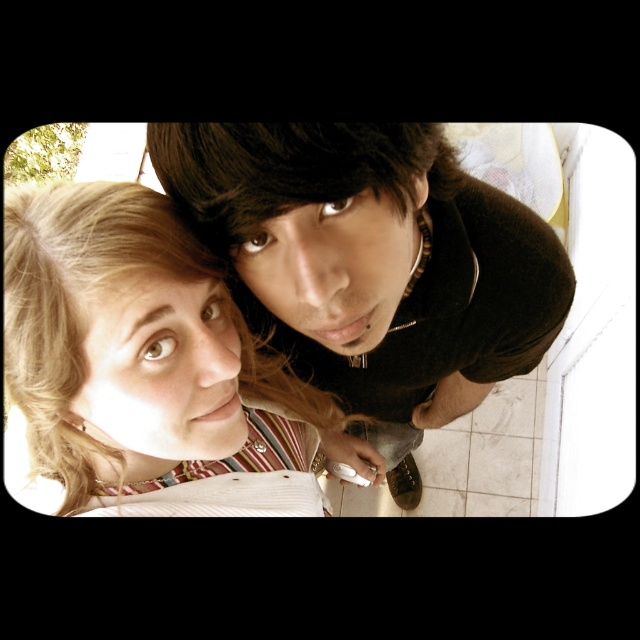
Question: Can you confirm if dark brown corduroy shirt at upper center is wider than blonde hair at upper left?

Choices:
 (A) yes
 (B) no

Answer: (A)

Question: Which point is farther to the camera?

Choices:
 (A) coord(58,227)
 (B) coord(264,273)

Answer: (B)

Question: Is dark brown corduroy shirt at upper center bigger than blonde hair at upper left?

Choices:
 (A) yes
 (B) no

Answer: (A)

Question: Does dark brown corduroy shirt at upper center have a larger size compared to blonde hair at upper left?

Choices:
 (A) yes
 (B) no

Answer: (A)

Question: Which object appears farthest from the camera in this image?

Choices:
 (A) blonde hair at upper left
 (B) dark brown corduroy shirt at upper center

Answer: (A)